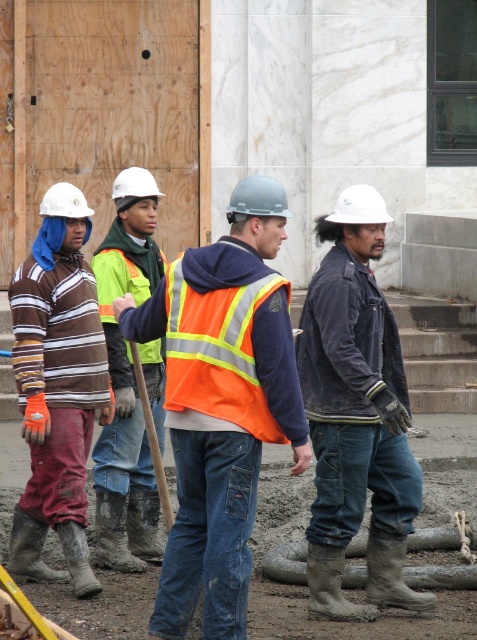
Is dark gray leather jacket at center in front of matte brown striped shirt at left?

Yes, dark gray leather jacket at center is in front of matte brown striped shirt at left.

Does dark gray leather jacket at center have a lesser width compared to matte brown striped shirt at left?

In fact, dark gray leather jacket at center might be wider than matte brown striped shirt at left.

This screenshot has width=477, height=640. I want to click on dark gray leather jacket at center, so click(x=355, y=416).

Find the location of a particular element. The width and height of the screenshot is (477, 640). dark gray leather jacket at center is located at coordinates (355, 416).

Who is lower down, matte brown striped shirt at left or orange reflective safety vest at center?

matte brown striped shirt at left is below.

Is the position of matte brown striped shirt at left less distant than that of orange reflective safety vest at center?

No, it is behind orange reflective safety vest at center.

Which is in front, point (83, 556) or point (253, 260)?

Point (253, 260) is more forward.

Where is `matte brown striped shirt at left`? matte brown striped shirt at left is located at coordinates (58, 387).

From the picture: Is dark gray leather jacket at center shorter than reflective orange safety vest at center?

Correct, dark gray leather jacket at center is not as tall as reflective orange safety vest at center.

The image size is (477, 640). What are the coordinates of `dark gray leather jacket at center` in the screenshot? It's located at point(355,416).

The image size is (477, 640). What are the coordinates of `dark gray leather jacket at center` in the screenshot? It's located at (355, 416).

The image size is (477, 640). I want to click on dark gray leather jacket at center, so click(x=355, y=416).